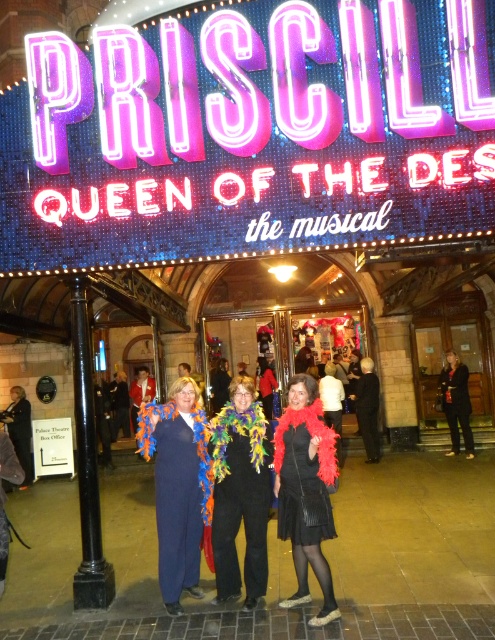
You are a photographer trying to capture a closeup of the blue velvet scarf at center without including the black polished metal pole at left in the frame. Given their sizes, is this possible?

The blue velvet scarf at center has a smaller size compared to black polished metal pole at left, so it is possible to capture a closeup of the blue velvet scarf at center without including the black polished metal pole at left in the frame.

What is the color of the feather boa at the location of point (241, 493)?

The point (241, 493) is on multicolored feather boa at center, so the color is part of the multicolored pattern of the feather boa at center.

You are a photographer trying to capture the multicolored feather boa at center and the black textured dress at center in a single shot. Which object will appear taller in the photo?

The multicolored feather boa at center will appear taller in the photo since it has a greater height compared to the black textured dress at center according to the description.